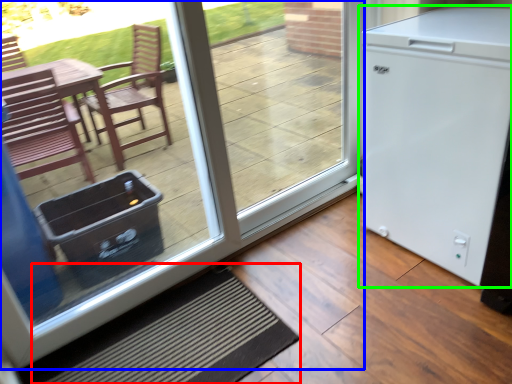
Question: Which is nearer to the doormat (highlighted by a red box)? door (highlighted by a blue box) or refrigerator (highlighted by a green box).

Choices:
 (A) door
 (B) refrigerator

Answer: (A)